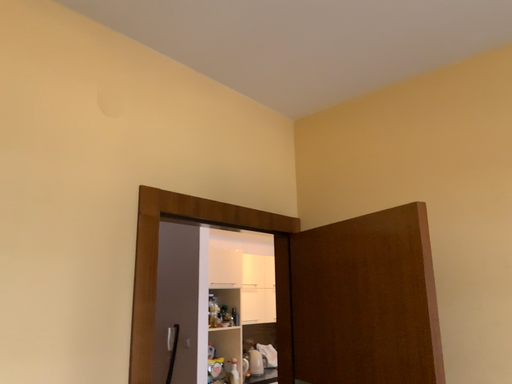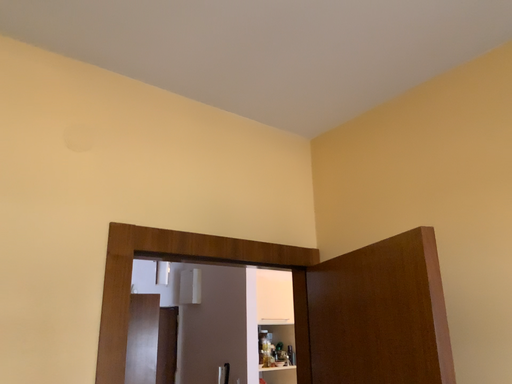
Question: How did the camera likely rotate when shooting the video?

Choices:
 (A) rotated right
 (B) rotated left

Answer: (B)